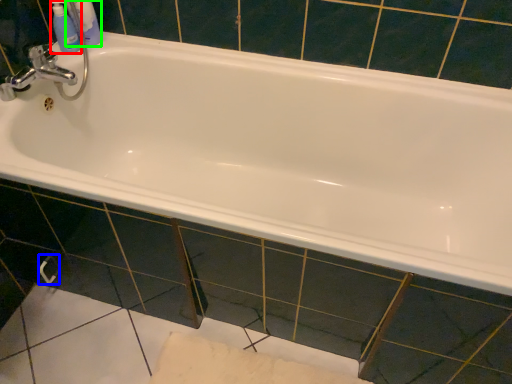
Question: Considering the real-world distances, which object is farthest from mouthwash (highlighted by a red box)? towel bar (highlighted by a blue box) or toiletry (highlighted by a green box)?

Choices:
 (A) towel bar
 (B) toiletry

Answer: (A)